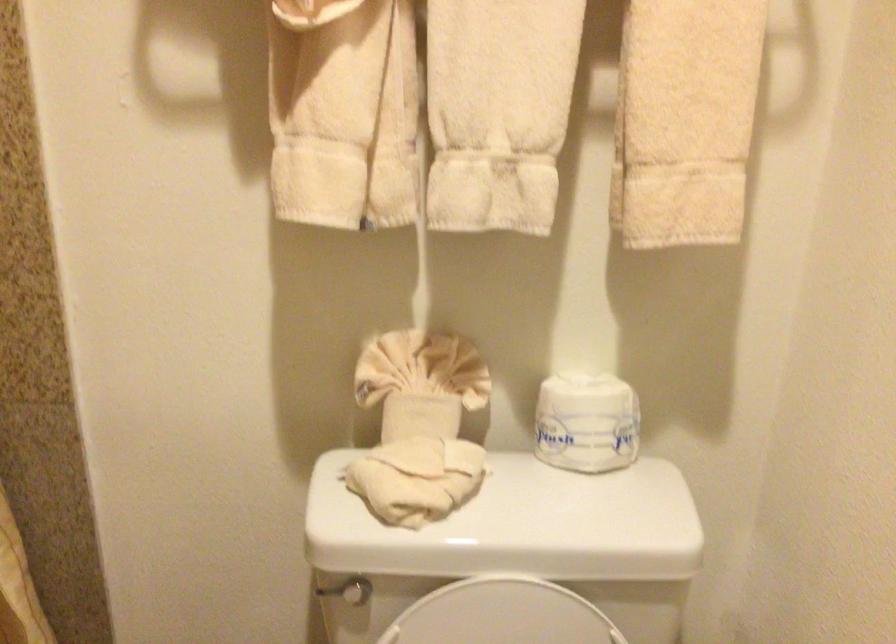
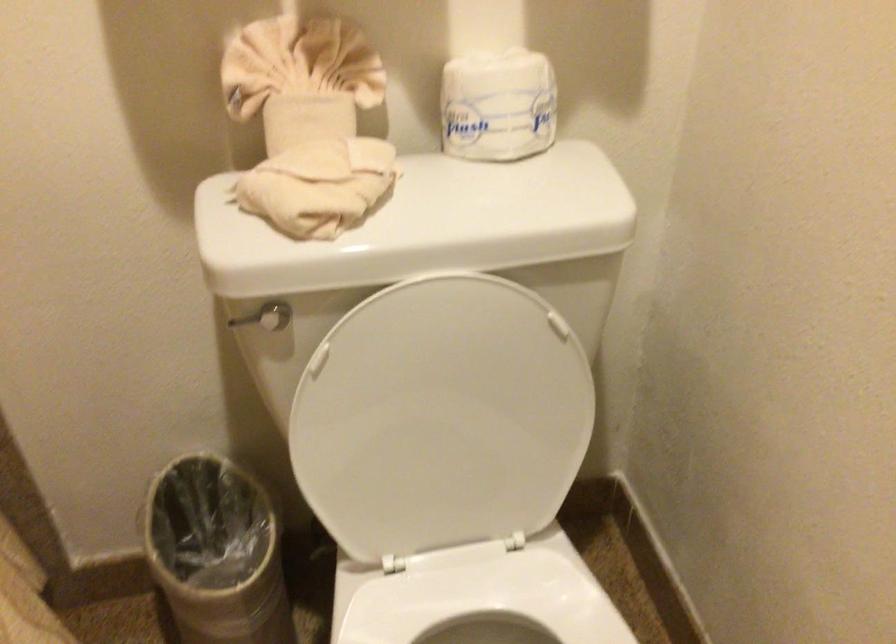
Consider the image. Which direction would the cameraman need to move to produce the second image?

The cameraman moved toward left, forward.